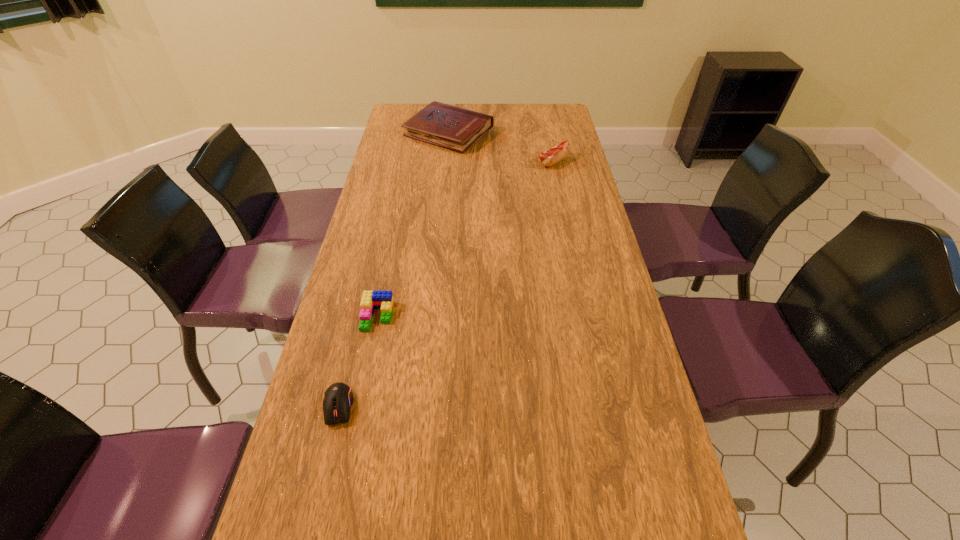
Locate an element on the screen. The height and width of the screenshot is (540, 960). object that is at the far edge is located at coordinates (451, 127).

The width and height of the screenshot is (960, 540). Identify the location of hardback book that is at the left edge. (451, 127).

I want to click on Lego located at the left edge, so click(371, 300).

Locate an element on the screen. computer mouse situated at the left edge is located at coordinates (338, 398).

At what (x,y) coordinates should I click in order to perform the action: click on object at the right edge. Please return your answer as a coordinate pair (x, y). Looking at the image, I should click on (560, 151).

Identify the location of object positioned at the far left corner. This screenshot has width=960, height=540. (451, 127).

This screenshot has width=960, height=540. In order to click on vacant region at the far edge of the desktop in this screenshot , I will do `click(480, 104)`.

Locate an element on the screen. The height and width of the screenshot is (540, 960). vacant space at the left edge of the desktop is located at coordinates pyautogui.click(x=334, y=325).

You are a GUI agent. You are given a task and a screenshot of the screen. Output one action in this format:
    pyautogui.click(x=<x>, y=<y>)
    Task: Click on the vacant space at the right edge
    Image resolution: width=960 pixels, height=540 pixels.
    Given the screenshot: What is the action you would take?
    pyautogui.click(x=556, y=142)

You are a GUI agent. You are given a task and a screenshot of the screen. Output one action in this format:
    pyautogui.click(x=<x>, y=<y>)
    Task: Click on the vacant space at the far right corner of the desktop
    The height and width of the screenshot is (540, 960).
    Given the screenshot: What is the action you would take?
    pyautogui.click(x=542, y=115)